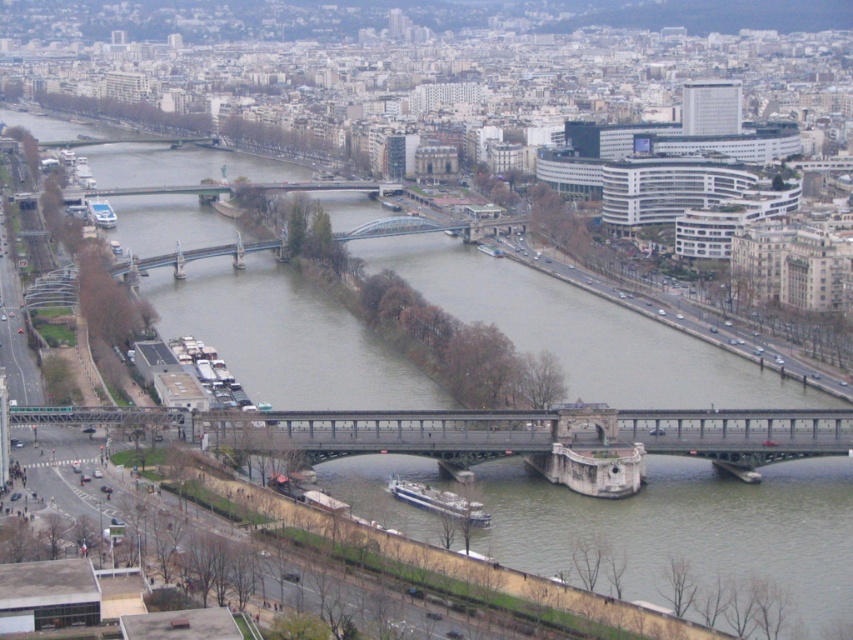
You are a photographer planning to take a photo of the white glossy ship at lower center and the white glossy boat at upper left. Based on their positions, which object should you focus on first to ensure both are in the frame?

The white glossy ship at lower center should be focused on first since it is located below the white glossy boat at upper left, ensuring the boat remains in the frame by starting from the lower position.

You are a drone operator flying a drone over the city. You need to fly from point A to point B. Point A is at coordinates point (643, 449) and point B is at point (471, 509). According to the image, which point is closer to the bridge that vehicles are using?

Point (471, 509) is closer to the bridge because point (643, 449) is behind it.